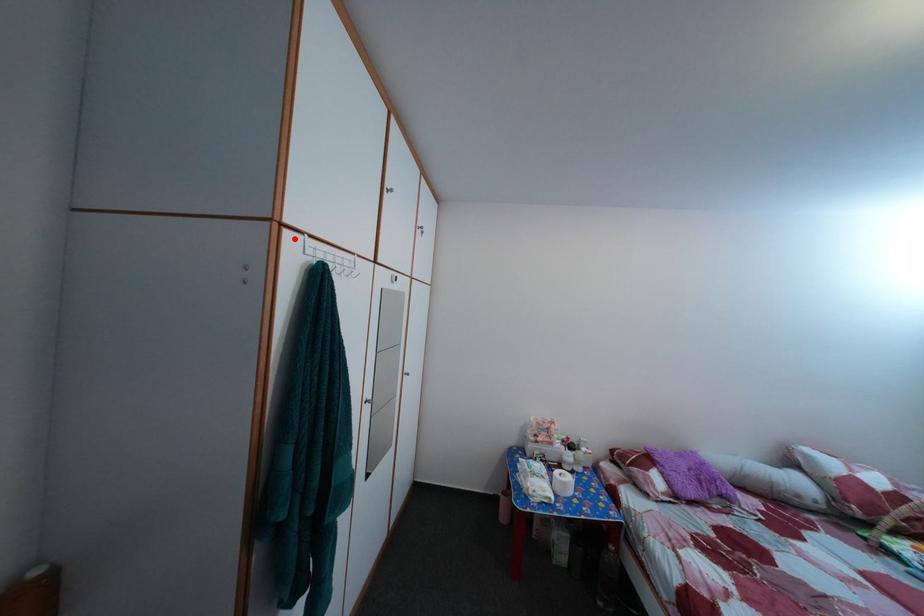
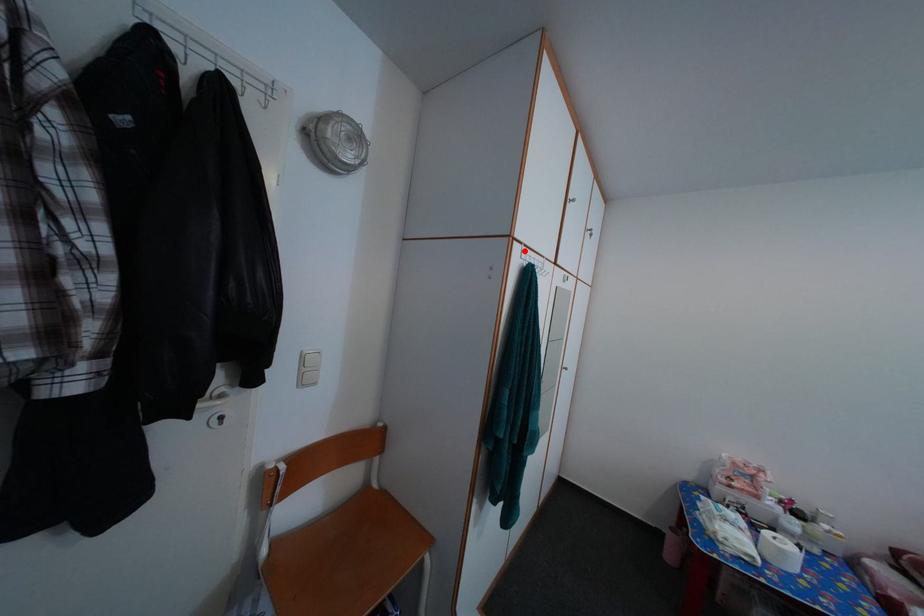
I am providing you with two images of the same scene from different viewpoints. A red point is marked on the first image and another point is marked on the second image. Are the points marked in image1 and image2 representing the same 3D position?

Yes